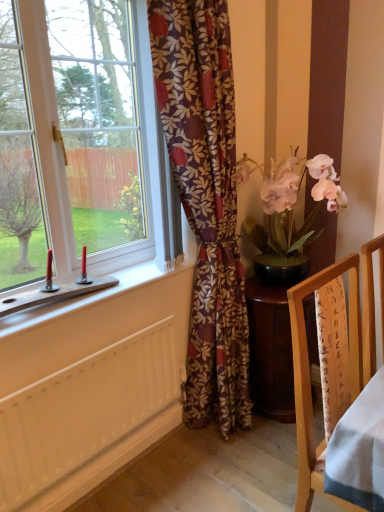
Where is `vacant space underneath white painted wood radiator at lower left (from a real-world perspective)`? The height and width of the screenshot is (512, 384). vacant space underneath white painted wood radiator at lower left (from a real-world perspective) is located at coordinates (123, 482).